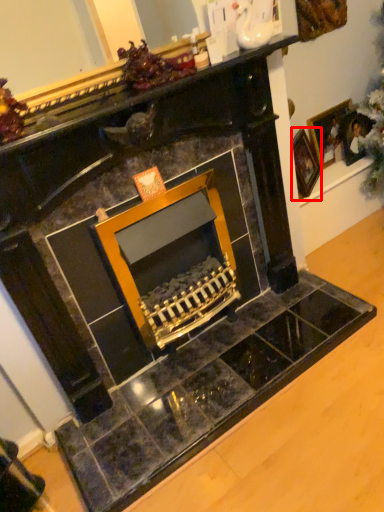
Question: From the image's perspective, where is picture frame (annotated by the red box) located in relation to picture frame in the image?

Choices:
 (A) below
 (B) above

Answer: (A)